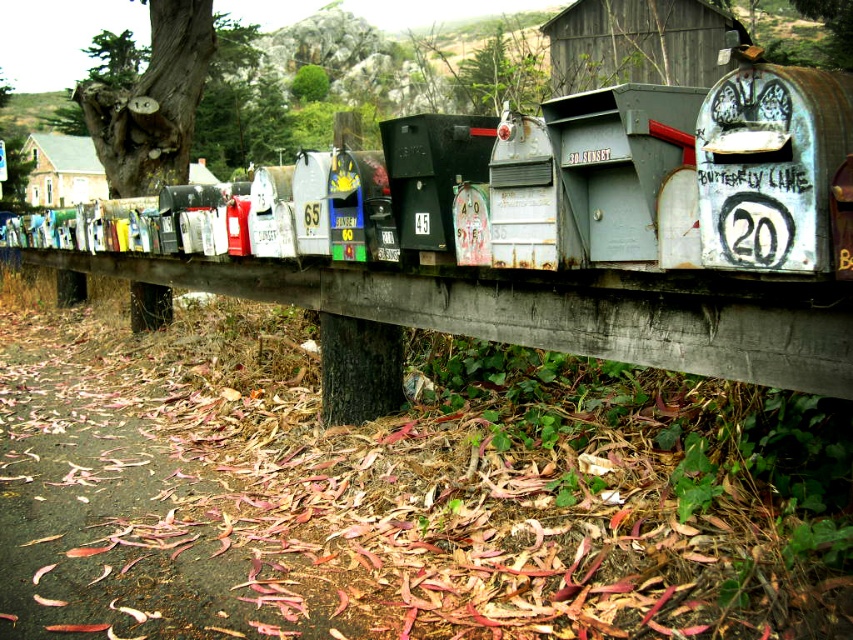
Is rusty metal mailbox at center-right bigger than matte black mailbox at center?

Incorrect, rusty metal mailbox at center-right is not larger than matte black mailbox at center.

Which is in front, point (721, 189) or point (398, 157)?

Positioned in front is point (721, 189).

This screenshot has height=640, width=853. Find the location of `rusty metal mailbox at center-right`. rusty metal mailbox at center-right is located at coordinates (776, 170).

Is point (607, 337) closer to viewer compared to point (828, 192)?

No.

Which is below, wooden rail at center or rusty metal mailbox at center-right?

Positioned lower is wooden rail at center.

Is point (512, 339) positioned behind point (706, 113)?

That is True.

The image size is (853, 640). Find the location of `wooden rail at center`. wooden rail at center is located at coordinates (548, 308).

Does rusty metal mailbox at center have a lesser width compared to matte black mailbox at center?

Yes, rusty metal mailbox at center is thinner than matte black mailbox at center.

Can you confirm if rusty metal mailbox at center is positioned above matte black mailbox at center?

No, rusty metal mailbox at center is not above matte black mailbox at center.

Is point (689, 108) behind point (438, 188)?

No, (689, 108) is in front of (438, 188).

Locate an element on the screen. The height and width of the screenshot is (640, 853). rusty metal mailbox at center is located at coordinates (619, 164).